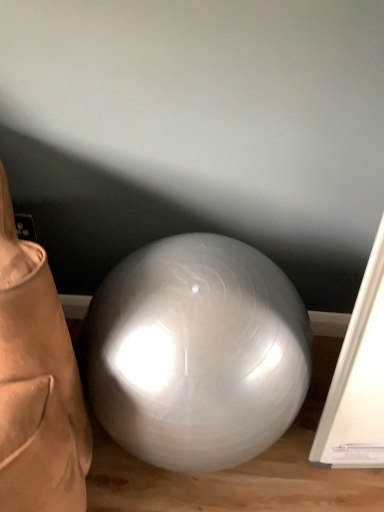
This screenshot has height=512, width=384. Describe the element at coordinates (196, 353) in the screenshot. I see `glossy white ball at center` at that location.

Identify the location of glossy white ball at center. Image resolution: width=384 pixels, height=512 pixels. (196, 353).

The image size is (384, 512). I want to click on glossy white ball at center, so click(x=196, y=353).